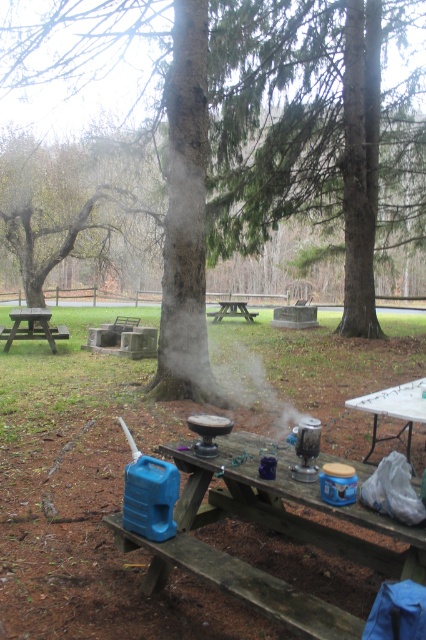
You are planning to take a photo of the smooth bark tree at upper left and the wooden picnic table at left. Which object should you focus on first if you want to capture both in a single frame without moving the camera?

You should focus on the smooth bark tree at upper left first because it is taller than the wooden picnic table at left, so it will occupy more space in the frame and ensure both are visible.

You are a hiker who wants to take a photo of the brown wooden picnic table at center. To avoid having the smooth bark tree at upper left in the background, which direction should you move relative to the picnic table?

Move to the right side of the brown wooden picnic table at center so that the smooth bark tree at upper left is no longer in the background.

You are standing at the picnic table and want to reach both the point at coordinates point (66, 236) and point (224, 308). Which point is closer to you?

Point (66, 236) is closer to you because it is further to the viewer than point (224, 308).